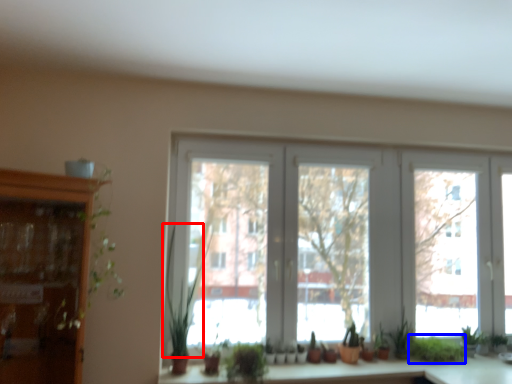
Question: Which object is further to the camera taking this photo, plant (highlighted by a red box) or plant (highlighted by a blue box)?

Choices:
 (A) plant
 (B) plant

Answer: (B)